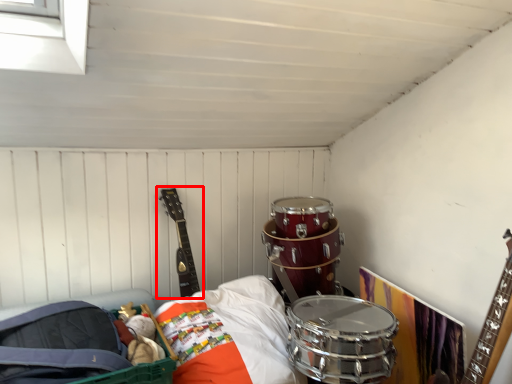
Question: From the image, what is the correct spatial relationship of guitar (annotated by the red box) in relation to drum?

Choices:
 (A) left
 (B) right

Answer: (B)